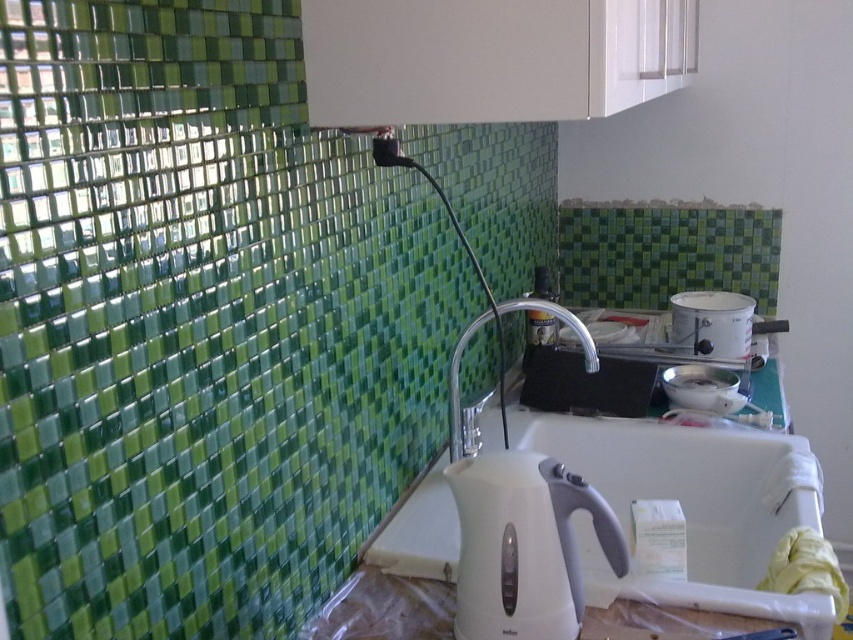
You have a small shelf that can only accommodate items narrower than 20 cm. You need to place the white plastic kettle at center and the white glossy pot at upper right on this shelf. Which item should you place first to ensure it fits?

The white plastic kettle at center has a smaller width than the white glossy pot at upper right. Since the shelf can only hold items narrower than 20 cm, you should place the white plastic kettle at center first to ensure it fits, then check if the pot also fits or needs a larger space.

You are standing in the kitchen and see two points marked on the floor. The first point is labeled as point (300, 616) and the second is point (461, 492). According to the scene description, which point is farther away from you?

Point (300, 616) is farther away from you because it is behind point (461, 492).